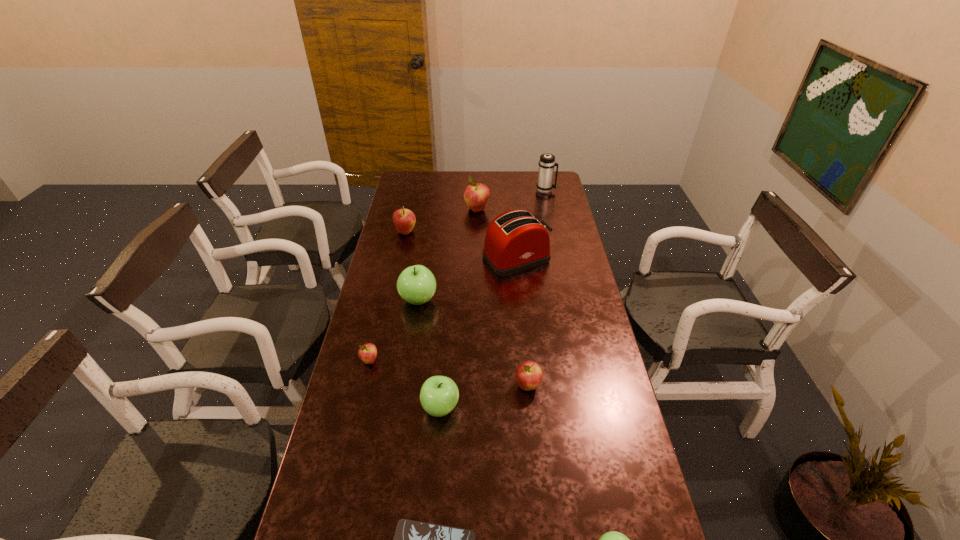
The width and height of the screenshot is (960, 540). In order to click on the seventh nearest object in this screenshot , I will do `click(515, 241)`.

The image size is (960, 540). I want to click on toaster, so click(x=515, y=241).

Locate an element on the screen. This screenshot has height=540, width=960. thermos bottle is located at coordinates (547, 163).

Find the location of `the tallest apple`. the tallest apple is located at coordinates (476, 195).

Where is `the farthest red apple`? The width and height of the screenshot is (960, 540). the farthest red apple is located at coordinates (476, 195).

The width and height of the screenshot is (960, 540). In order to click on the second farthest apple in this screenshot , I will do `click(404, 220)`.

This screenshot has width=960, height=540. I want to click on the eighth nearest object, so click(x=404, y=220).

This screenshot has width=960, height=540. I want to click on the third farthest apple, so [x=416, y=284].

The height and width of the screenshot is (540, 960). I want to click on the biggest green apple, so point(416,284).

Identify the location of the second biggest green apple. Image resolution: width=960 pixels, height=540 pixels. (439, 395).